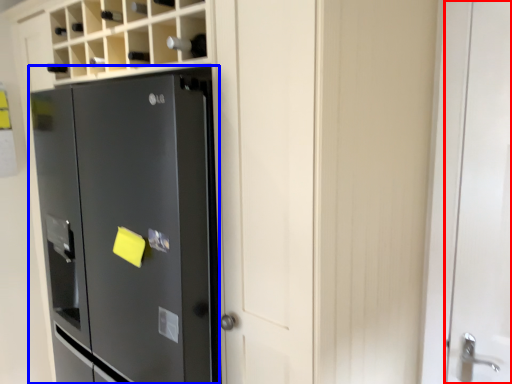
Question: Which object is closer to the camera taking this photo, door (highlighted by a red box) or refrigerator (highlighted by a blue box)?

Choices:
 (A) door
 (B) refrigerator

Answer: (B)